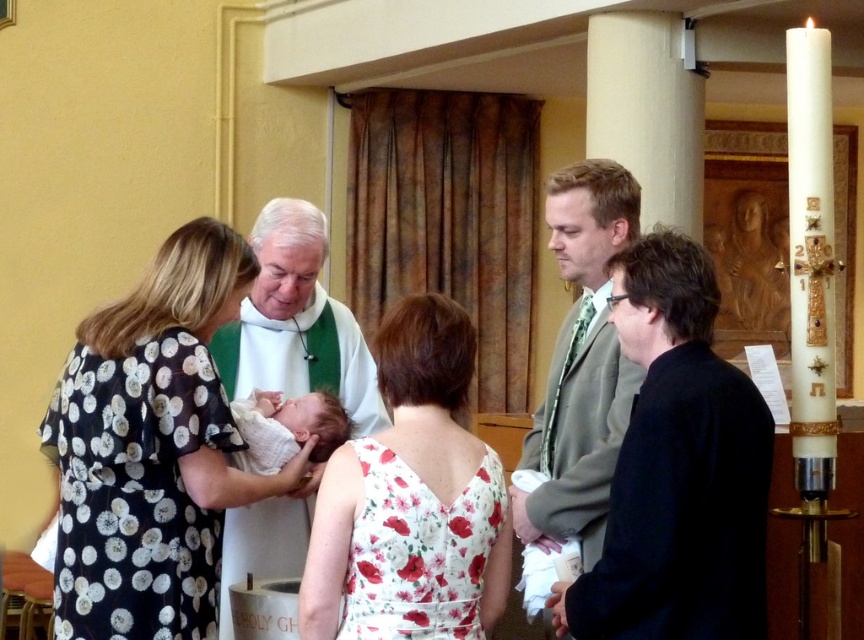
Which of these two, black dotted dress at center or floral fabric dress at center, stands shorter?

floral fabric dress at center is shorter.

You are a GUI agent. You are given a task and a screenshot of the screen. Output one action in this format:
    pyautogui.click(x=<x>, y=<y>)
    Task: Click on the black dotted dress at center
    Image resolution: width=864 pixels, height=640 pixels.
    Given the screenshot: What is the action you would take?
    pyautogui.click(x=151, y=449)

Can you confirm if floral fabric dress at center is bigger than white soft cloth at center?

Yes.

Between point (458, 380) and point (306, 419), which one is positioned behind?

Point (306, 419)

You are a GUI agent. You are given a task and a screenshot of the screen. Output one action in this format:
    pyautogui.click(x=<x>, y=<y>)
    Task: Click on the floral fabric dress at center
    This screenshot has width=864, height=640.
    Given the screenshot: What is the action you would take?
    pyautogui.click(x=417, y=481)

Who is more forward, (637,408) or (538,529)?

Positioned in front is point (637,408).

Which of these two, dark brown suit at right or green textured tie at center, stands shorter?

With less height is dark brown suit at right.

Find the location of a particular element. dark brown suit at right is located at coordinates (677, 468).